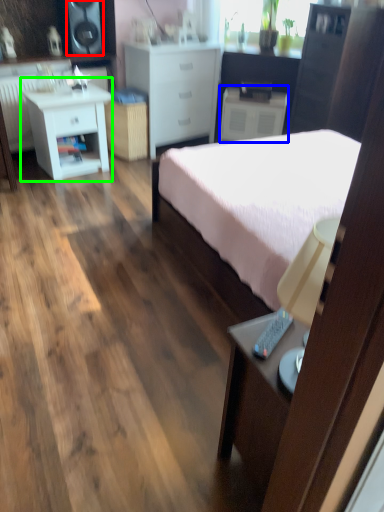
Question: Which object is the farthest from speaker (highlighted by a red box)? Choose among these: nightstand (highlighted by a blue box) or nightstand (highlighted by a green box).

Choices:
 (A) nightstand
 (B) nightstand

Answer: (A)